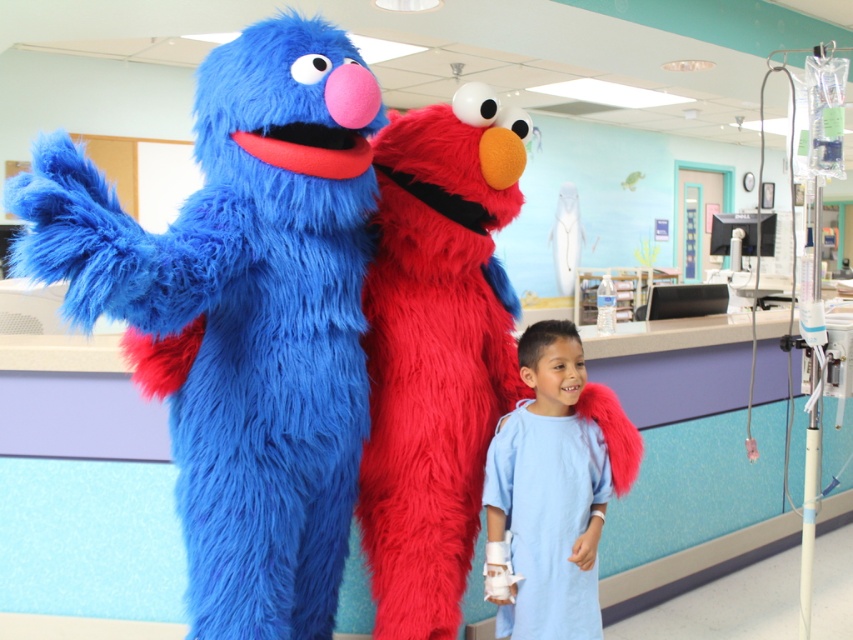
Does fuzzy blue grover at left have a smaller size compared to light blue fabric gown at lower center?

Incorrect, fuzzy blue grover at left is not smaller in size than light blue fabric gown at lower center.

Based on the photo, does fuzzy blue grover at left lie in front of light blue fabric gown at lower center?

That is True.

Is point (212, 221) in front of point (576, 509)?

Yes, it is in front of point (576, 509).

You are a GUI agent. You are given a task and a screenshot of the screen. Output one action in this format:
    pyautogui.click(x=<x>, y=<y>)
    Task: Click on the fuzzy blue grover at left
    
    Given the screenshot: What is the action you would take?
    pyautogui.click(x=241, y=316)

Between fluffy red elmo at center and light blue fabric gown at lower center, which one has less height?

Standing shorter between the two is light blue fabric gown at lower center.

Which is behind, point (393, 595) or point (515, 449)?

Point (515, 449)

Where is `fluffy red elmo at center`? fluffy red elmo at center is located at coordinates coord(434,349).

Can you confirm if fuzzy blue grover at left is positioned to the right of fluffy red elmo at center?

No, fuzzy blue grover at left is not to the right of fluffy red elmo at center.

Is fuzzy blue grover at left below fluffy red elmo at center?

Incorrect, fuzzy blue grover at left is not positioned below fluffy red elmo at center.

This screenshot has height=640, width=853. In order to click on fuzzy blue grover at left in this screenshot , I will do `click(241, 316)`.